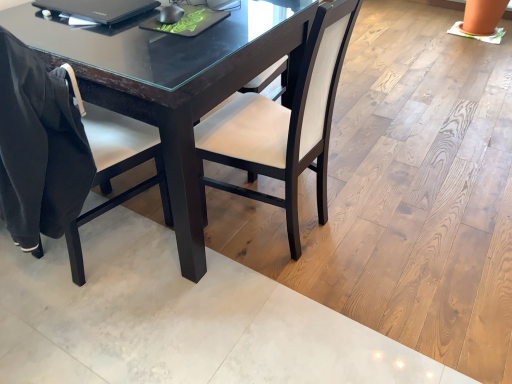
Locate an element on the screen. This screenshot has width=512, height=384. free space in front of satin white chair at center, the 2th chair viewed from the left is located at coordinates (268, 293).